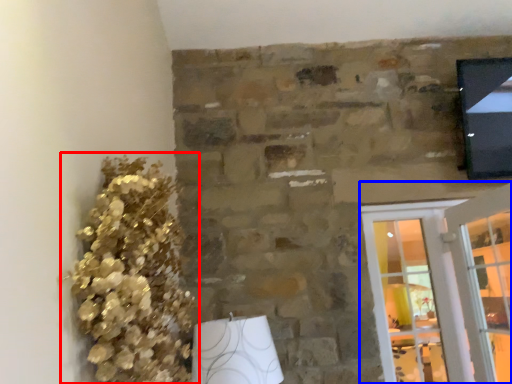
Question: Which point is further to the camera, floral arrangement (highlighted by a red box) or screen door (highlighted by a blue box)?

Choices:
 (A) floral arrangement
 (B) screen door

Answer: (B)